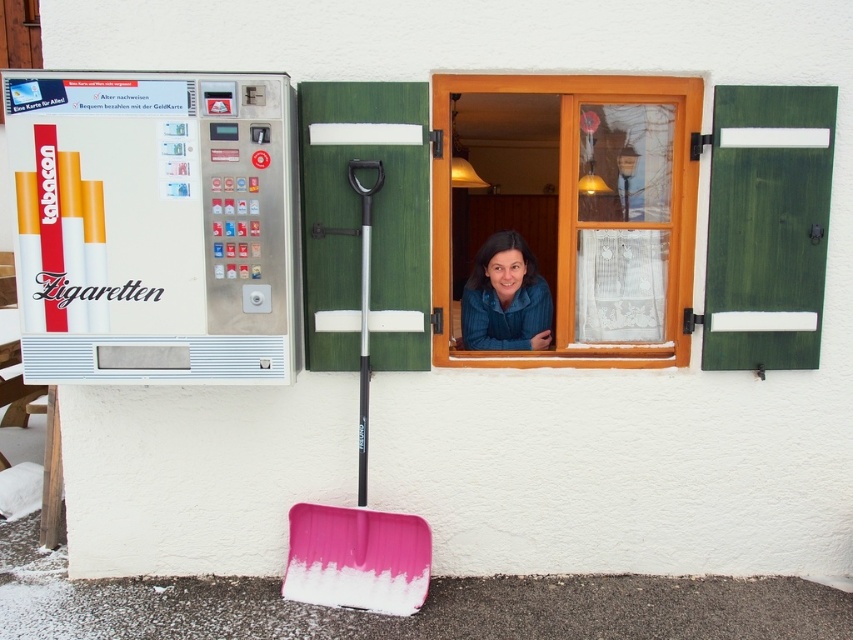
You are standing in front of the wall with the window and vending machine. There are two points marked on the wall. Which point is closer to you, the point at coordinate (712,108) or the point at (364,340)?

The point at coordinate (712,108) is further away from you than the point at (364,340), so the point at (364,340) is closer to you.

You are a delivery person who needs to place a large package that is 1.8 meters tall in the alley next to the metallic silver vending machine at left and the blue textured shirt at window. Based on the scene, can the package fit vertically between them without exceeding the height limit?

The metallic silver vending machine at left is much taller than the blue textured shirt at window. Since the package is 1.8 meters tall, it might exceed the height of the shorter object, which is the blue textured shirt at window. However, since the vending machine is taller, the package could potentially fit if placed next to it. But without knowing the exact height of the vending machine, it is uncertain. However, since the description states the vending machine is much taller, it is likely the package of